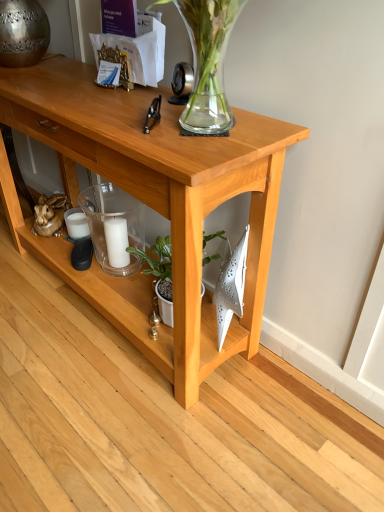
Where is `white matte candle at center`? This screenshot has width=384, height=512. white matte candle at center is located at coordinates (116, 241).

The height and width of the screenshot is (512, 384). In order to click on green matte plant at center in this screenshot , I will do `click(158, 258)`.

In order to click on light wood table at center in this screenshot , I will do `click(151, 203)`.

You are a GUI agent. You are given a task and a screenshot of the screen. Output one action in this format:
    pyautogui.click(x=<x>, y=<y>)
    Task: Click on the white matte candle at center
    This screenshot has width=384, height=512.
    Given the screenshot: What is the action you would take?
    pyautogui.click(x=116, y=241)

Can you tell me how much transparent glass candle at center and light wood table at center differ in facing direction?

They differ by 1.25 degrees in their facing directions.

From a real-world perspective, between transparent glass candle at center and light wood table at center, who is vertically lower?

transparent glass candle at center, from a real-world perspective.

How much distance is there between transparent glass candle at center and light wood table at center?

The distance of transparent glass candle at center from light wood table at center is 30.35 centimeters.

Based on the photo, would you say transparent glass candle at center contains light wood table at center?

That's incorrect, light wood table at center is not inside transparent glass candle at center.

The height and width of the screenshot is (512, 384). In order to click on houseplant located on the right of white matte candle at center in this screenshot , I will do `click(158, 258)`.

Considering the sizes of green matte plant at center and white matte candle at center in the image, is green matte plant at center taller or shorter than white matte candle at center?

Considering their sizes, green matte plant at center has more height than white matte candle at center.

In the scene shown: Is green matte plant at center not near white matte candle at center?

No, there isn't a large distance between green matte plant at center and white matte candle at center.

Is light wood table at center taller than green matte plant at center?

Yes, light wood table at center is taller than green matte plant at center.

From the picture: Do you think light wood table at center is within green matte plant at center, or outside of it?

light wood table at center cannot be found inside green matte plant at center.

Are light wood table at center and green matte plant at center making contact?

No.

From the image's perspective, who appears lower, light wood table at center or green matte plant at center?

From the image's view, green matte plant at center is below.

How many degrees apart are the facing directions of transparent glass candle at center and green matte plant at center?

The angular difference between transparent glass candle at center and green matte plant at center is 0.458 degrees.

How much distance is there between transparent glass candle at center and green matte plant at center?

They are 7.70 inches apart.

Is green matte plant at center a part of transparent glass candle at center?

No, green matte plant at center is located outside of transparent glass candle at center.

Which is behind, transparent glass candle at center or green matte plant at center?

transparent glass candle at center is further away from the camera.

Based on the photo, which object is thinner, transparent glass candle at center or white matte candle at center?

With smaller width is white matte candle at center.

In terms of height, does transparent glass candle at center look taller or shorter compared to white matte candle at center?

Clearly, transparent glass candle at center is taller compared to white matte candle at center.

Considering the relative positions of transparent glass candle at center and white matte candle at center in the image provided, is transparent glass candle at center to the left of white matte candle at center from the viewer's perspective?

Indeed, transparent glass candle at center is positioned on the left side of white matte candle at center.

Who is shorter, white matte candle at center or green matte plant at center?

white matte candle at center is shorter.

Is white matte candle at center far away from green matte plant at center?

No, there isn't a large distance between white matte candle at center and green matte plant at center.

Which point is more forward, (112,220) or (160,271)?

The point (160,271) is in front.

Is point (158, 250) positioned before point (120, 253)?

Yes, it is in front of point (120, 253).

From a real-world perspective, relative to transparent glass candle at center, is green matte plant at center vertically above or below?

green matte plant at center is situated lower than transparent glass candle at center in the real world.

In the image, is green matte plant at center on the left side or the right side of transparent glass candle at center?

Clearly, green matte plant at center is on the right of transparent glass candle at center in the image.

Based on the photo, between green matte plant at center and transparent glass candle at center, which one has smaller width?

transparent glass candle at center.

Identify the location of candle holder below the light wood table at center (from a real-world perspective). This screenshot has width=384, height=512. (114, 227).

Locate an element on the screen. The image size is (384, 512). houseplant lying below the white matte candle at center (from the image's perspective) is located at coordinates (158, 258).

Based on their spatial positions, is white matte candle at center or green matte plant at center closer to transparent glass candle at center?

white matte candle at center.

Based on their spatial positions, is white matte candle at center or light wood table at center closer to green matte plant at center?

The object closer to green matte plant at center is white matte candle at center.

Looking at the image, which one is located further to transparent glass candle at center, green matte plant at center or white matte candle at center?

The object further to transparent glass candle at center is green matte plant at center.

Consider the image. Estimate the real-world distances between objects in this image. Which object is closer to transparent glass candle at center, light wood table at center or white matte candle at center?

The object closer to transparent glass candle at center is white matte candle at center.

Considering their positions, is transparent glass candle at center positioned closer to green matte plant at center than light wood table at center?

Among the two, transparent glass candle at center is located nearer to green matte plant at center.

When comparing their distances from transparent glass candle at center, does green matte plant at center or light wood table at center seem closer?

Among the two, green matte plant at center is located nearer to transparent glass candle at center.

When comparing their distances from light wood table at center, does green matte plant at center or white matte candle at center seem closer?

Result: Among the two, green matte plant at center is located nearer to light wood table at center.

Considering their positions, is transparent glass candle at center positioned further to white matte candle at center than light wood table at center?

light wood table at center is positioned further to the anchor white matte candle at center.

The height and width of the screenshot is (512, 384). Identify the location of houseplant positioned between light wood table at center and white matte candle at center from near to far. (158, 258).

Identify the location of candle holder between green matte plant at center and white matte candle at center from front to back. (114, 227).

The height and width of the screenshot is (512, 384). I want to click on houseplant between light wood table at center and transparent glass candle at center in the front-back direction, so click(158, 258).

The height and width of the screenshot is (512, 384). I want to click on candle holder positioned between light wood table at center and white matte candle at center from near to far, so (114, 227).